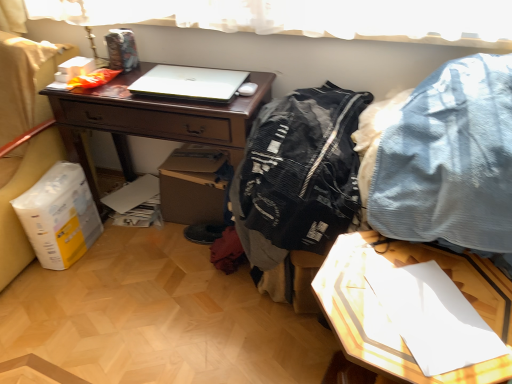
Where is `free space above white matte laptop at center (from a real-world perspective)`? This screenshot has height=384, width=512. free space above white matte laptop at center (from a real-world perspective) is located at coordinates (193, 86).